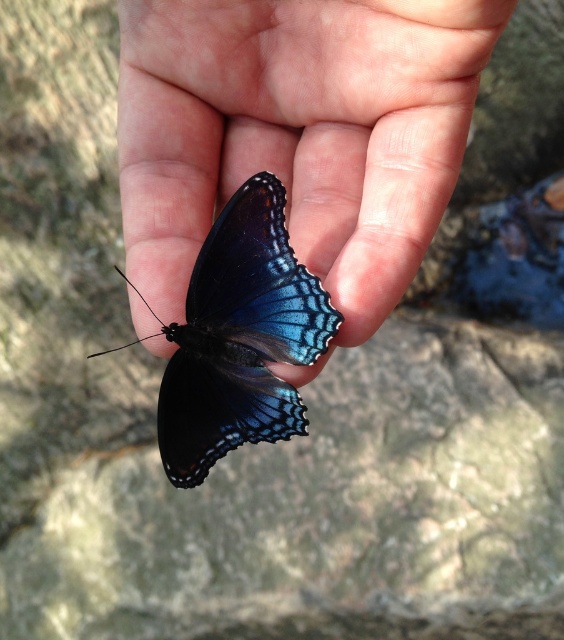
You are a photographer trying to capture a detailed shot of the matte black butterfly at center. Your camera has a minimum focus distance of 30 inches. Can you focus on the butterfly without moving closer?

The matte black butterfly at center is 33.55 inches from the viewer, which is beyond the camera minimum focus distance of 30 inches. Therefore, the camera can focus on the butterfly without needing to move closer.